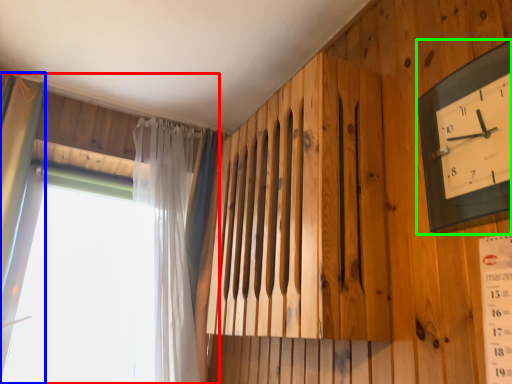
Question: Which object is the closest to the window (highlighted by a red box)? Choose among these: curtain (highlighted by a blue box) or wall clock (highlighted by a green box).

Choices:
 (A) curtain
 (B) wall clock

Answer: (A)